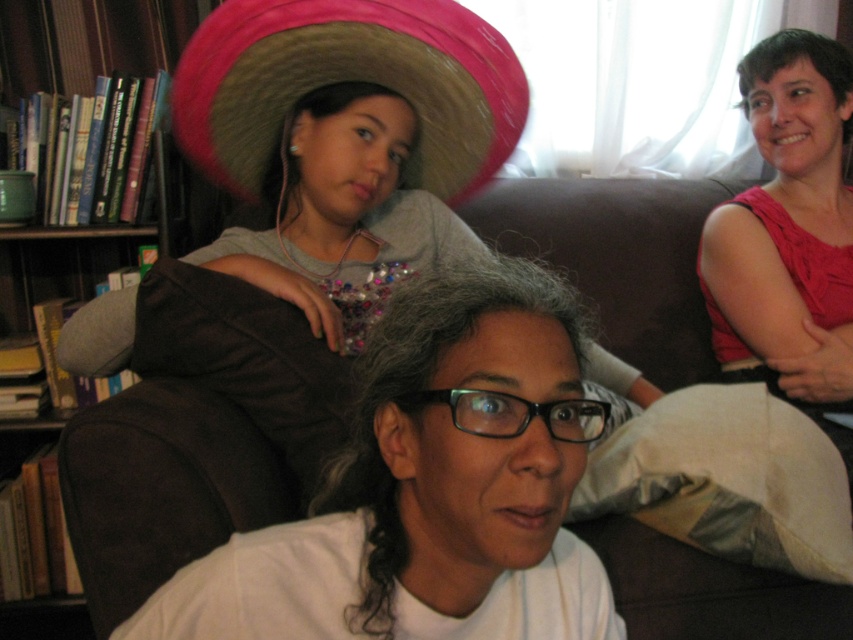
Is point (683, 195) closer to viewer compared to point (488, 100)?

No.

Who is shorter, brown fabric couch at center or pink straw sombrero at upper center?

pink straw sombrero at upper center

What do you see at coordinates (196, 433) in the screenshot? This screenshot has width=853, height=640. I see `brown fabric couch at center` at bounding box center [196, 433].

This screenshot has width=853, height=640. In order to click on brown fabric couch at center in this screenshot , I will do `click(196, 433)`.

Who is shorter, pink straw sombrero at upper center or wooden bookshelf at left?

pink straw sombrero at upper center is shorter.

Describe the element at coordinates (349, 81) in the screenshot. I see `pink straw sombrero at upper center` at that location.

Between point (265, 4) and point (200, 193), which one is positioned in front?

Point (265, 4) is more forward.

Locate an element on the screen. pink straw sombrero at upper center is located at coordinates (349, 81).

What do you see at coordinates (196, 433) in the screenshot?
I see `brown fabric couch at center` at bounding box center [196, 433].

The width and height of the screenshot is (853, 640). Describe the element at coordinates (196, 433) in the screenshot. I see `brown fabric couch at center` at that location.

Identify the location of brown fabric couch at center. (196, 433).